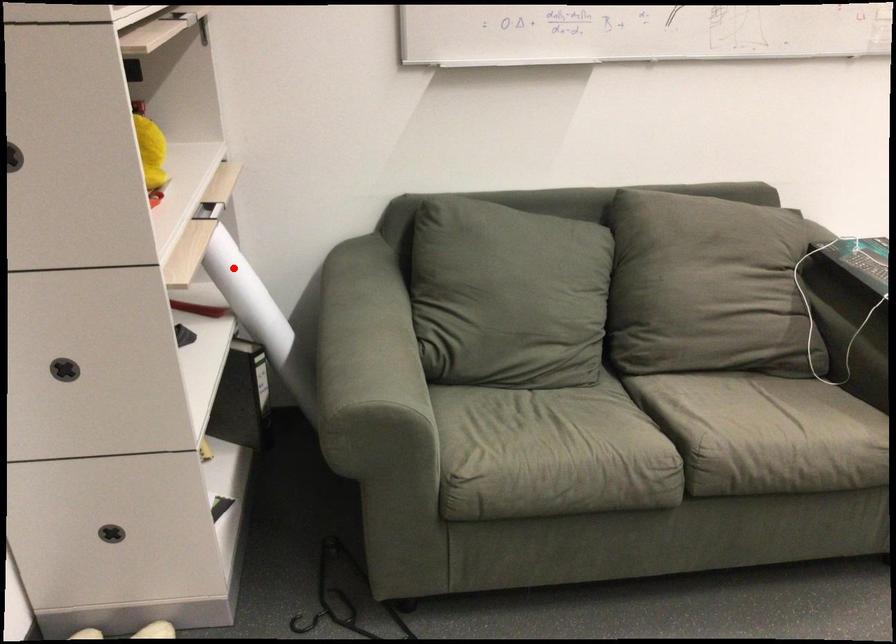
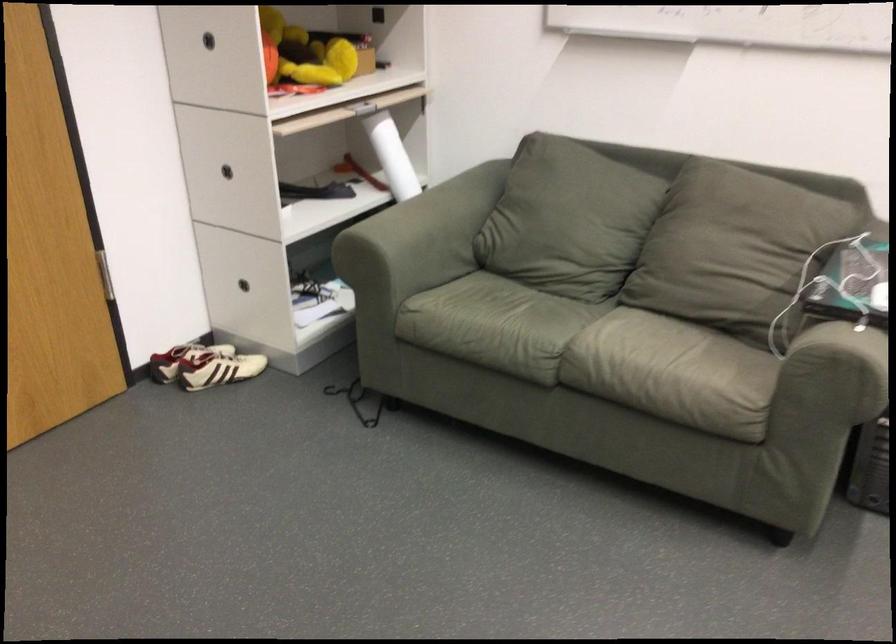
Question: I am providing you with two images of the same scene from different viewpoints. In image1, a red point is highlighted. Considering the same 3D point in image2, which of the following is correct?

Choices:
 (A) It is closer
 (B) It is farther

Answer: (B)